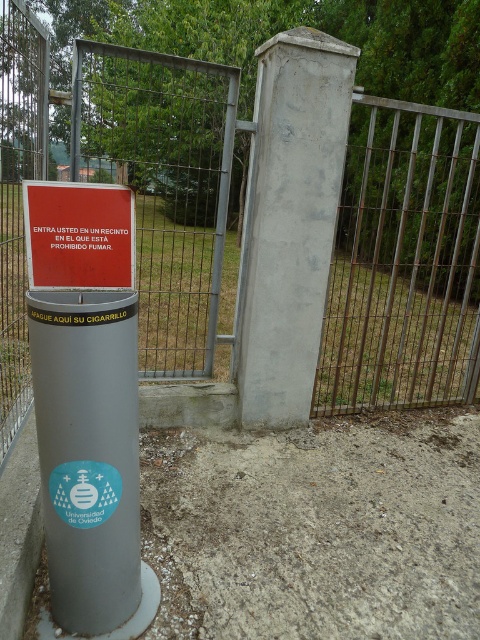
Question: Is metallic gate at center closer to the viewer compared to red matte sign at center?

Choices:
 (A) no
 (B) yes

Answer: (A)

Question: Which of the following is the closest to the observer?

Choices:
 (A) red matte sign at center
 (B) metallic gate at center

Answer: (A)

Question: Among these objects, which one is nearest to the camera?

Choices:
 (A) red matte sign at center
 (B) metallic gate at center

Answer: (A)

Question: From the image, what is the correct spatial relationship of metallic gate at center in relation to red matte sign at center?

Choices:
 (A) left
 (B) right

Answer: (A)

Question: Is metallic gate at center thinner than red matte sign at center?

Choices:
 (A) no
 (B) yes

Answer: (A)